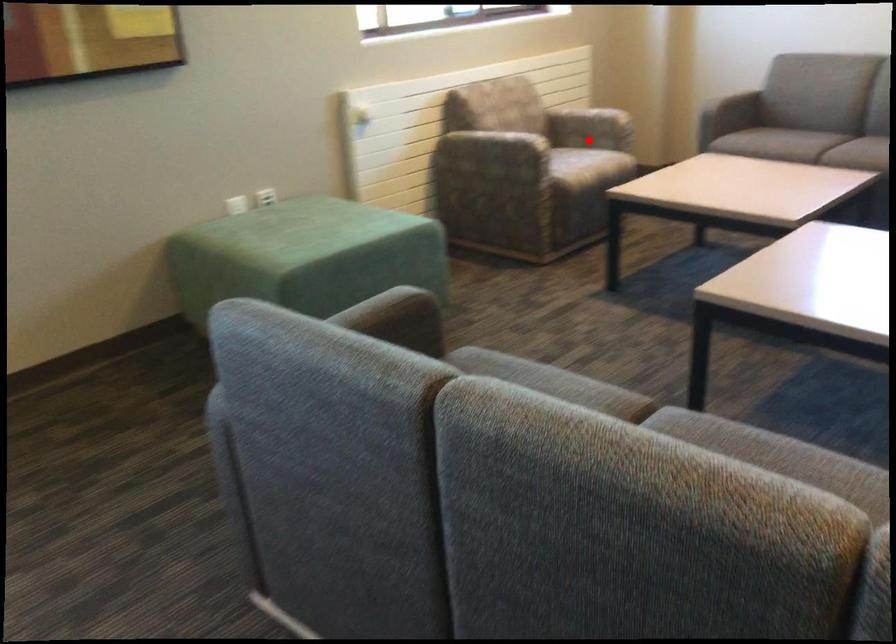
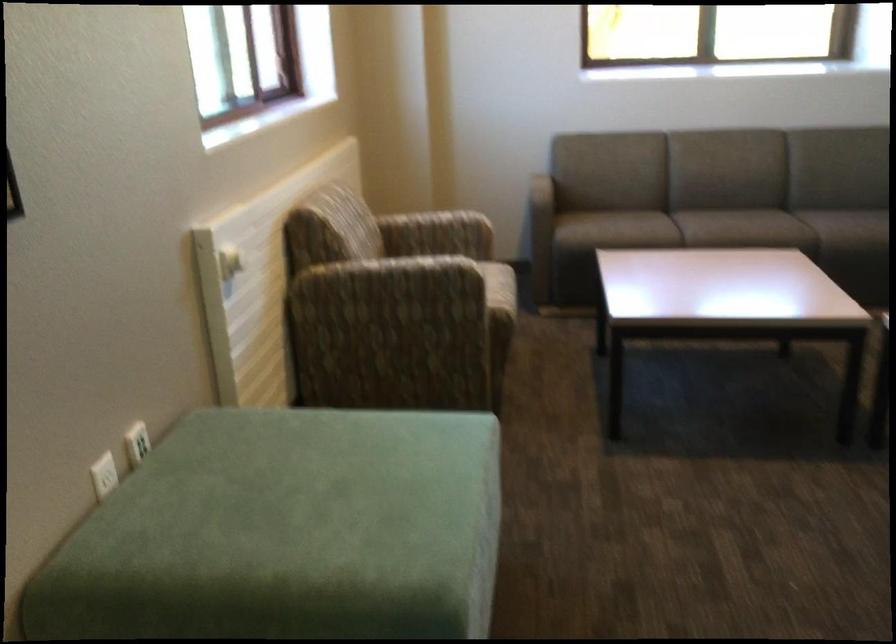
Question: I am providing you with two images of the same scene from different viewpoints. In image1, a red point is highlighted. Considering the same 3D point in image2, which of the following is correct?

Choices:
 (A) It is closer
 (B) It is farther

Answer: (A)